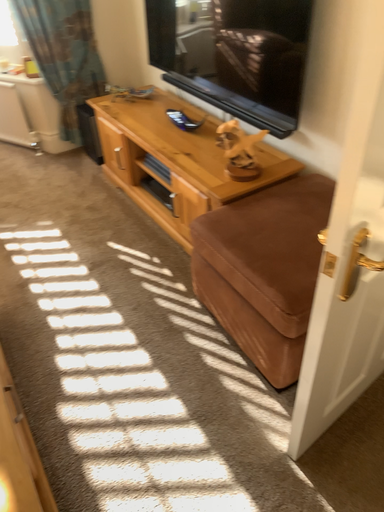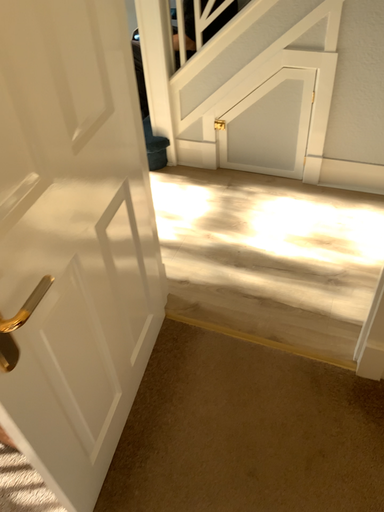
Question: Which way did the camera rotate in the video?

Choices:
 (A) rotated downward
 (B) rotated upward

Answer: (B)